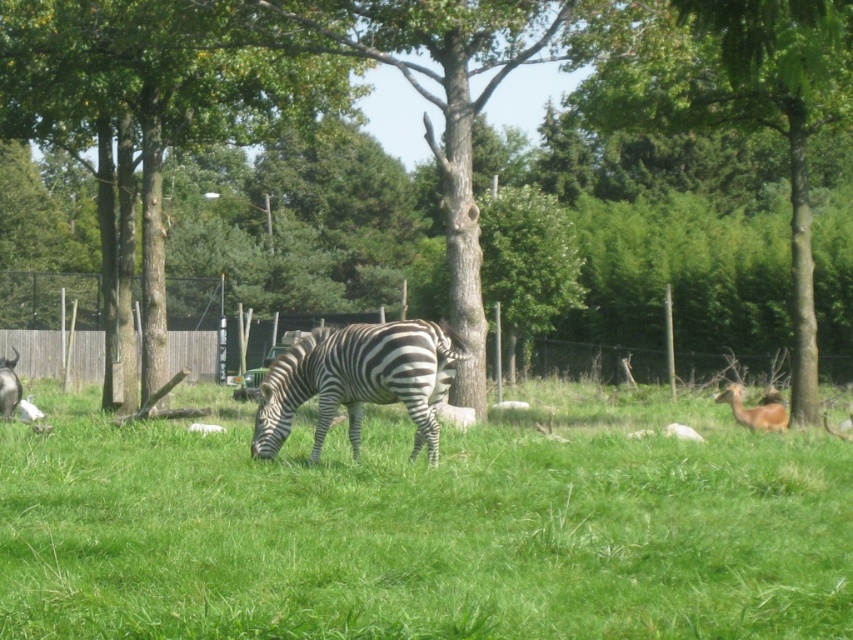
Question: Is green textured tree at center thinner than brown furry deer at right?

Choices:
 (A) no
 (B) yes

Answer: (A)

Question: Which object appears closest to the camera in this image?

Choices:
 (A) green grassy at center
 (B) black and white striped zebra at center
 (C) green leafy tree at center
 (D) brown textured tree at center

Answer: (A)

Question: Among these objects, which one is nearest to the camera?

Choices:
 (A) green textured tree at center
 (B) brown furry deer at right
 (C) brown textured tree at center
 (D) black and white striped zebra at center

Answer: (C)

Question: Considering the real-world distances, which object is closest to the green textured tree at center?

Choices:
 (A) black and white striped zebra at center
 (B) green leafy tree at center
 (C) brown furry deer at right
 (D) brown textured tree at center

Answer: (D)

Question: Does brown textured tree at center have a greater width compared to green leafy tree at center?

Choices:
 (A) yes
 (B) no

Answer: (A)

Question: Is brown textured tree at center bigger than green grassy at center?

Choices:
 (A) yes
 (B) no

Answer: (A)